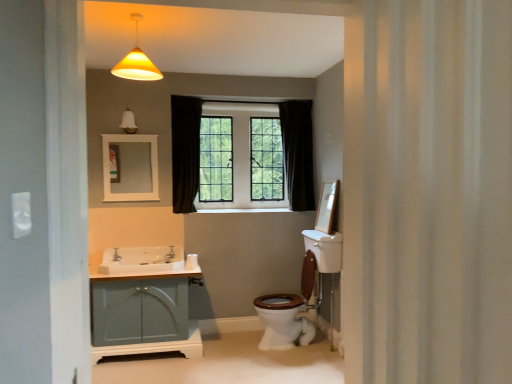
Question: Are white glossy sink at lower left and white textured shower curtain at right making contact?

Choices:
 (A) no
 (B) yes

Answer: (A)

Question: From the image's perspective, is white glossy sink at lower left beneath white textured shower curtain at right?

Choices:
 (A) yes
 (B) no

Answer: (A)

Question: From a real-world perspective, is white glossy sink at lower left beneath white textured shower curtain at right?

Choices:
 (A) no
 (B) yes

Answer: (B)

Question: Is white glossy sink at lower left oriented towards white textured shower curtain at right?

Choices:
 (A) yes
 (B) no

Answer: (B)

Question: Would you say white textured shower curtain at right is part of white glossy sink at lower left's contents?

Choices:
 (A) yes
 (B) no

Answer: (B)

Question: Would you say white matte toilet paper at lower center is to the left or to the right of matte glass bell at upper center in the picture?

Choices:
 (A) right
 (B) left

Answer: (A)

Question: Is white matte toilet paper at lower center situated inside matte glass bell at upper center or outside?

Choices:
 (A) inside
 (B) outside

Answer: (B)

Question: From the image's perspective, is white matte toilet paper at lower center located above or below matte glass bell at upper center?

Choices:
 (A) below
 (B) above

Answer: (A)

Question: Is white matte toilet paper at lower center wider or thinner than matte glass bell at upper center?

Choices:
 (A) wide
 (B) thin

Answer: (B)

Question: From their relative heights in the image, would you say matte teal cabinet at lower left is taller or shorter than white textured shower curtain at right?

Choices:
 (A) short
 (B) tall

Answer: (A)

Question: From a real-world perspective, is matte teal cabinet at lower left physically located above or below white textured shower curtain at right?

Choices:
 (A) below
 (B) above

Answer: (A)

Question: Would you say matte teal cabinet at lower left is to the left or to the right of white textured shower curtain at right in the picture?

Choices:
 (A) right
 (B) left

Answer: (B)

Question: In terms of width, does matte teal cabinet at lower left look wider or thinner when compared to white textured shower curtain at right?

Choices:
 (A) wide
 (B) thin

Answer: (A)

Question: Is point (168, 253) closer or farther from the camera than point (125, 165)?

Choices:
 (A) closer
 (B) farther

Answer: (B)

Question: Considering their positions, is white glossy sink at lower left located in front of or behind white matte mirror at upper center?

Choices:
 (A) front
 (B) behind

Answer: (A)